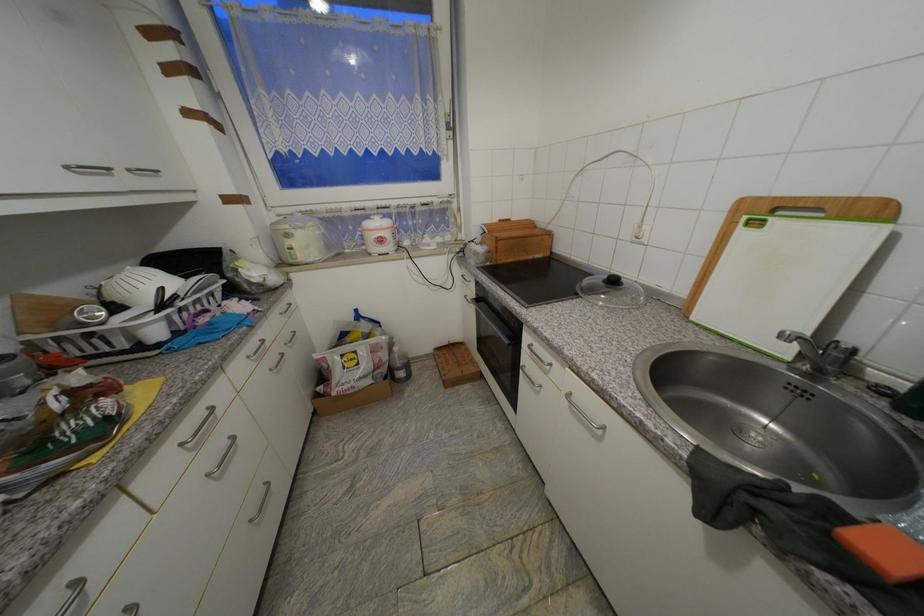
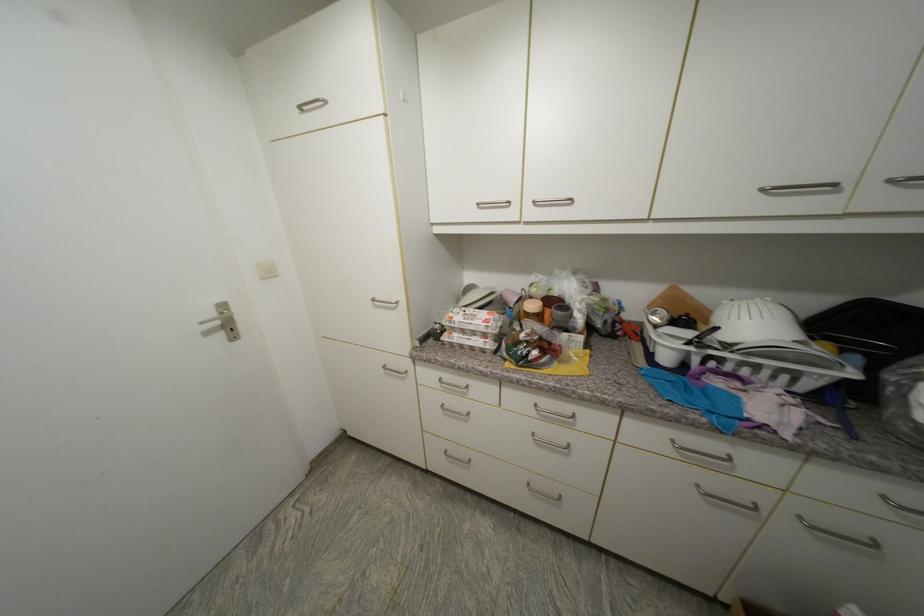
In the second image, find the point that corresponds to point 35,298 in the first image.

(685, 292)